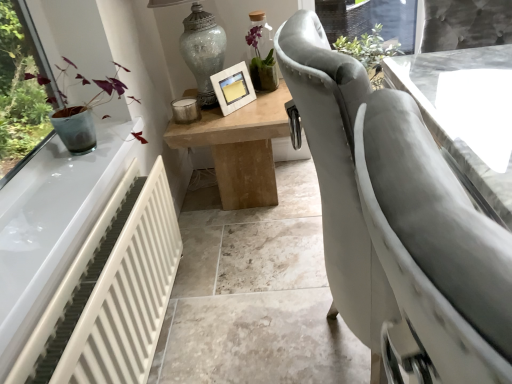
Locate an element on the screen. vacant region in front of light brown wooden table at center, placed as the 2th table when sorted from right to left is located at coordinates (250, 253).